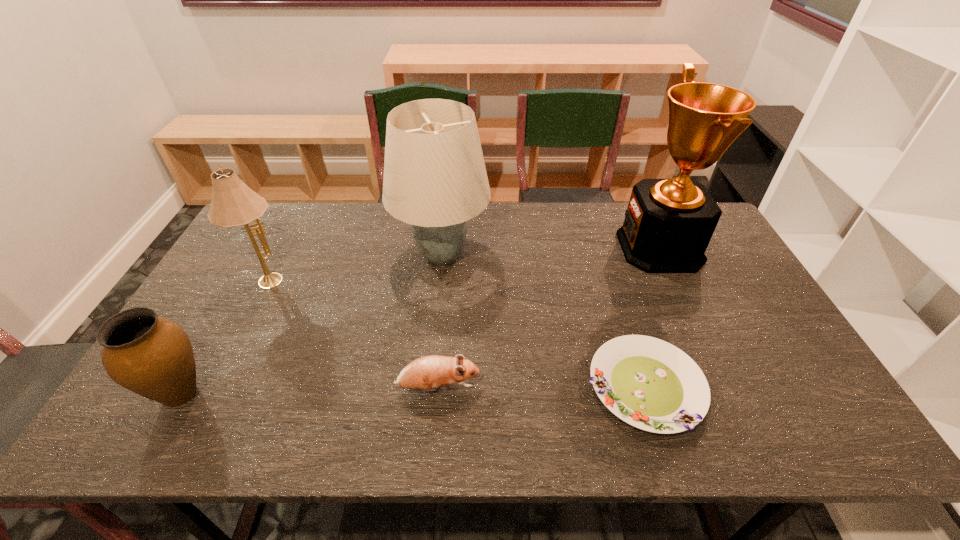
At what (x,y) coordinates should I click in order to perform the action: click on vacant space located 0.110m on the left of the taller lampshade. Please return your answer as a coordinate pair (x, y). Looking at the image, I should click on (359, 256).

Locate an element on the screen. The height and width of the screenshot is (540, 960). free spot located on the right of the shorter lampshade is located at coordinates (358, 278).

Where is `vacant space located 0.320m on the right of the urn`? The height and width of the screenshot is (540, 960). vacant space located 0.320m on the right of the urn is located at coordinates (348, 394).

At what (x,y) coordinates should I click in order to perform the action: click on free region located at the face of the second shortest object. Please return your answer as a coordinate pair (x, y). Image resolution: width=960 pixels, height=540 pixels. Looking at the image, I should click on (500, 388).

You are a GUI agent. You are given a task and a screenshot of the screen. Output one action in this format:
    pyautogui.click(x=<x>, y=<y>)
    Task: Click on the vacant space located on the back of the shortest object
    The height and width of the screenshot is (540, 960).
    Given the screenshot: What is the action you would take?
    pyautogui.click(x=621, y=311)

Locate an element on the screen. trophy cup present at the far edge is located at coordinates (668, 224).

Find the location of a particular element. Image resolution: width=960 pixels, height=540 pixels. lampshade that is at the far edge is located at coordinates point(435,179).

The width and height of the screenshot is (960, 540). Find the location of `urn that is positioned at the near edge`. urn that is positioned at the near edge is located at coordinates tap(151, 356).

The width and height of the screenshot is (960, 540). Identify the location of salad plate present at the near edge. click(x=648, y=383).

Identify the location of lampshade that is at the left edge. (233, 203).